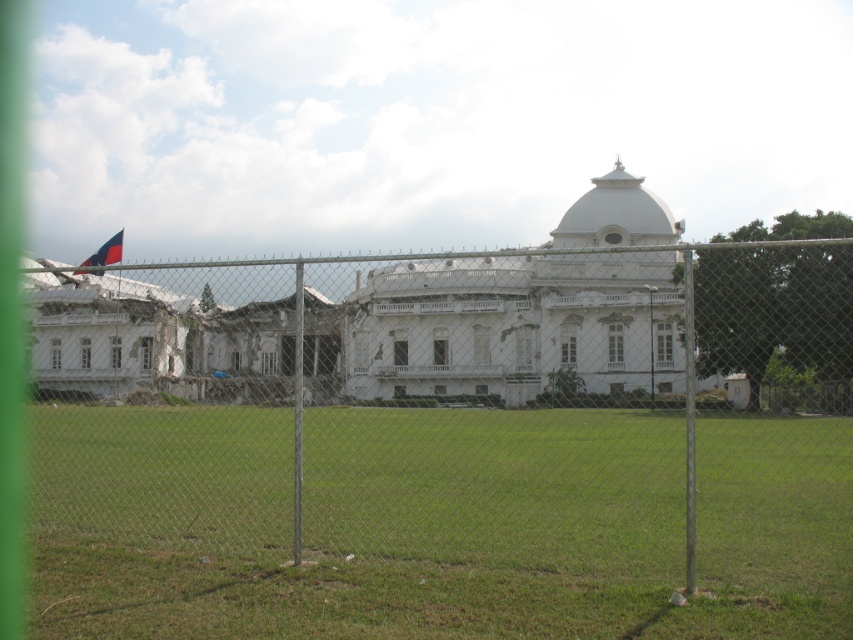
Question: Is metal chain-link fence at center closer to the viewer compared to green grass at center?

Choices:
 (A) yes
 (B) no

Answer: (B)

Question: Is metal chain-link fence at center to the left of green grass at center from the viewer's perspective?

Choices:
 (A) yes
 (B) no

Answer: (B)

Question: Which point is closer to the camera?

Choices:
 (A) green grass at center
 (B) metal chain-link fence at center

Answer: (A)

Question: Is metal chain-link fence at center to the left of green grass at center from the viewer's perspective?

Choices:
 (A) yes
 (B) no

Answer: (B)